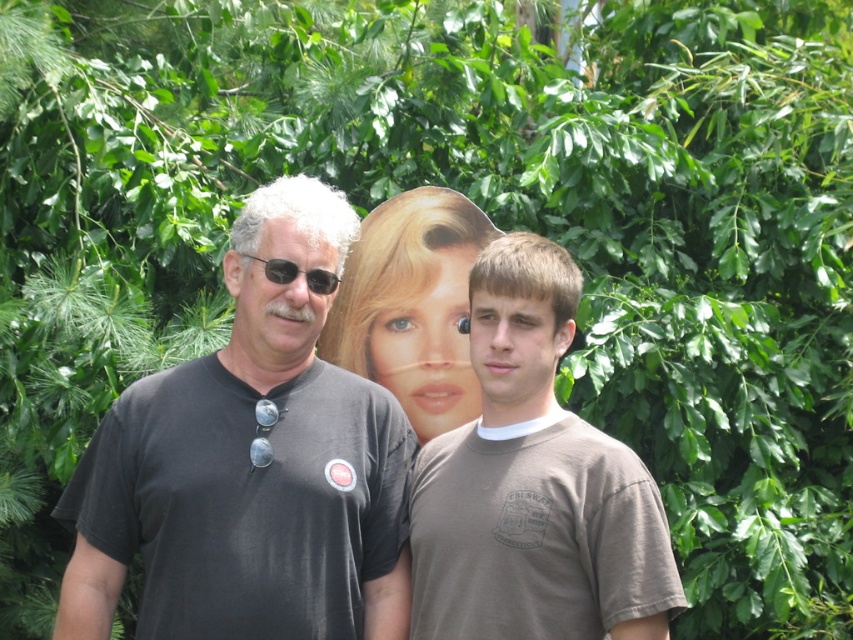
Does brown cotton t-shirt at center come behind smooth plastic poster at center?

No.

Does point (538, 522) come farther from viewer compared to point (421, 428)?

No, it is not.

This screenshot has height=640, width=853. Find the location of `brown cotton t-shirt at center`. brown cotton t-shirt at center is located at coordinates (532, 484).

How much distance is there between black matte t-shirt at left and smooth plastic poster at center?

26.48 inches

Who is positioned more to the left, black matte t-shirt at left or smooth plastic poster at center?

→ From the viewer's perspective, black matte t-shirt at left appears more on the left side.

The image size is (853, 640). Describe the element at coordinates (250, 467) in the screenshot. I see `black matte t-shirt at left` at that location.

The image size is (853, 640). I want to click on black matte t-shirt at left, so click(x=250, y=467).

Can you confirm if black matte t-shirt at left is positioned to the right of black plastic sunglasses at left?

In fact, black matte t-shirt at left is to the left of black plastic sunglasses at left.

Does black matte t-shirt at left have a smaller size compared to black plastic sunglasses at left?

No.

Identify the location of black matte t-shirt at left. (250, 467).